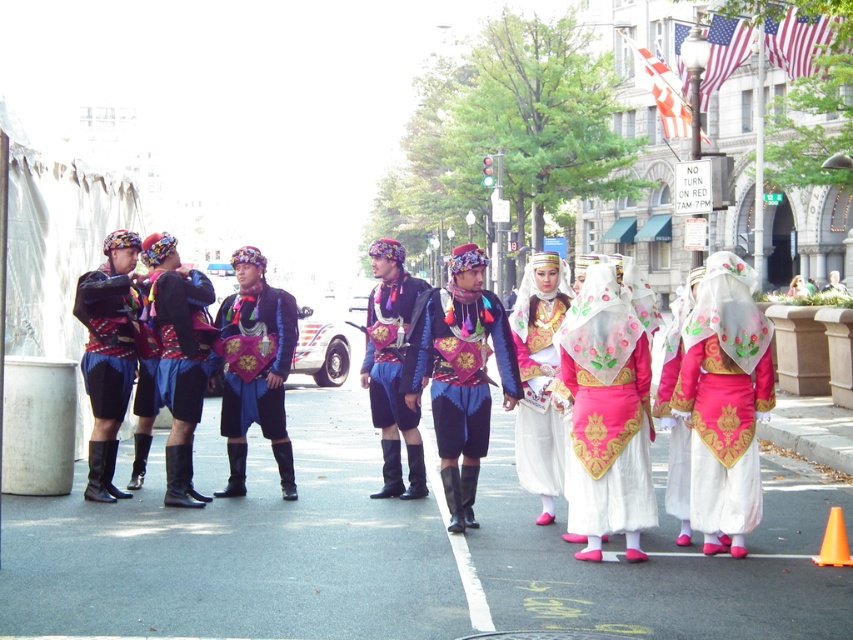
Question: Is matte black boots at left positioned at the back of velvet blue skirt at center?

Choices:
 (A) no
 (B) yes

Answer: (B)

Question: Based on their relative distances, which object is nearer to the velvet blue skirt at center?

Choices:
 (A) orange plastic cone at lower right
 (B) white satin dress at center

Answer: (B)

Question: Among these objects, which one is farthest from the camera?

Choices:
 (A) velvet blue vest at center
 (B) matte black boots at left
 (C) orange plastic cone at lower right

Answer: (A)

Question: Can you confirm if matte black boots at left is positioned above velvet blue vest at center?

Choices:
 (A) yes
 (B) no

Answer: (B)

Question: Is white satin dress at center further to camera compared to silky white veil at center?

Choices:
 (A) yes
 (B) no

Answer: (B)

Question: Which of the following is the farthest from the observer?

Choices:
 (A) (834, 282)
 (B) (416, 456)
 (C) (752, 492)
 (D) (552, 278)

Answer: (A)